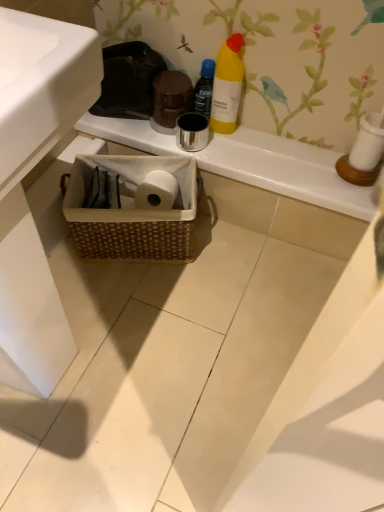
Question: Is woven basket at center in contact with yellow matte bottle at upper center, which is the 2th bottle in left-to-right order?

Choices:
 (A) yes
 (B) no

Answer: (B)

Question: Is woven basket at center positioned in front of yellow matte bottle at upper center, which is the 2th bottle in left-to-right order?

Choices:
 (A) yes
 (B) no

Answer: (B)

Question: Considering the relative sizes of woven basket at center and yellow matte bottle at upper center, which is the 2th bottle in left-to-right order, in the image provided, is woven basket at center taller than yellow matte bottle at upper center, which is the 2th bottle in left-to-right order,?

Choices:
 (A) no
 (B) yes

Answer: (A)

Question: From the image's perspective, is woven basket at center over yellow matte bottle at upper center, which is the 1th bottle in right-to-left order?

Choices:
 (A) no
 (B) yes

Answer: (A)

Question: Is yellow matte bottle at upper center, which is the 1th bottle in right-to-left order, at the back of woven basket at center?

Choices:
 (A) no
 (B) yes

Answer: (A)

Question: Is woven basket at center at the left side of yellow matte bottle at upper center, which is the 2th bottle in left-to-right order?

Choices:
 (A) yes
 (B) no

Answer: (B)

Question: Is woven brown basket at lower center a part of yellow matte bottle at upper center, the first bottle when ordered from left to right?

Choices:
 (A) no
 (B) yes

Answer: (A)

Question: From the image's perspective, is yellow matte bottle at upper center, the first bottle when ordered from left to right, located beneath woven brown basket at lower center?

Choices:
 (A) yes
 (B) no

Answer: (B)

Question: Is woven brown basket at lower center at the back of yellow matte bottle at upper center, the first bottle when ordered from left to right?

Choices:
 (A) yes
 (B) no

Answer: (B)

Question: Does yellow matte bottle at upper center, positioned as the second bottle in right-to-left order, have a lesser height compared to woven brown basket at lower center?

Choices:
 (A) no
 (B) yes

Answer: (B)

Question: Considering the relative sizes of yellow matte bottle at upper center, positioned as the second bottle in right-to-left order, and woven brown basket at lower center in the image provided, is yellow matte bottle at upper center, positioned as the second bottle in right-to-left order, taller than woven brown basket at lower center?

Choices:
 (A) yes
 (B) no

Answer: (B)

Question: Is yellow matte bottle at upper center, the first bottle when ordered from left to right, positioned behind woven brown basket at lower center?

Choices:
 (A) yes
 (B) no

Answer: (A)

Question: Considering the relative sizes of woven brown basket at lower center and white glossy sink at lower left in the image provided, is woven brown basket at lower center wider than white glossy sink at lower left?

Choices:
 (A) no
 (B) yes

Answer: (A)